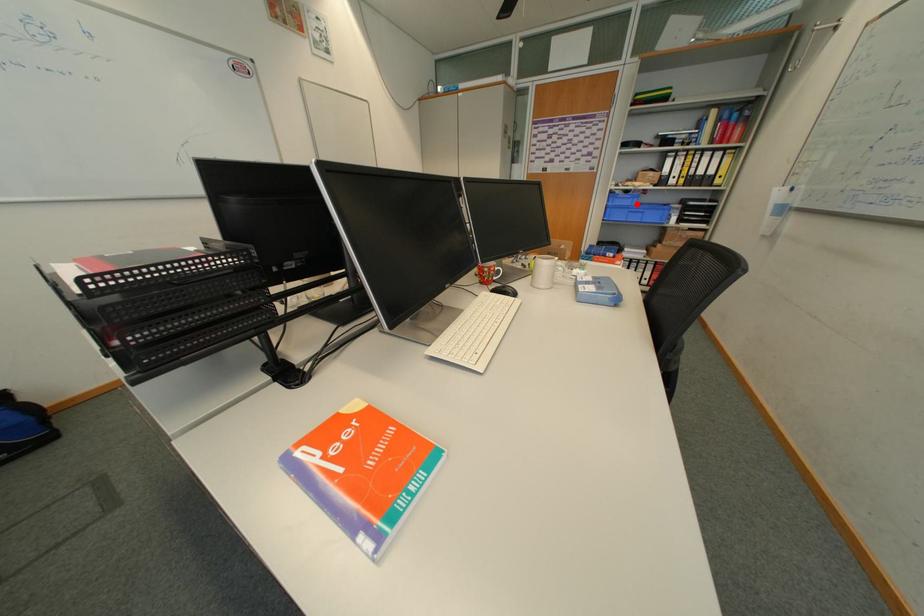
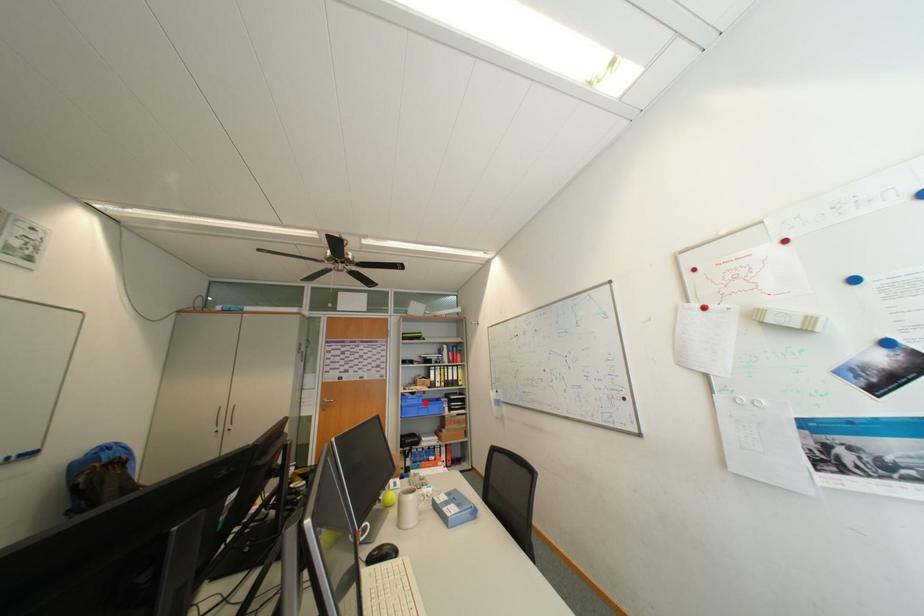
I am providing you with two images of the same scene from different viewpoints. A red point is marked on the first image and another point is marked on the second image. Do the highlighted points in image1 and image2 indicate the same real-world spot?

Yes